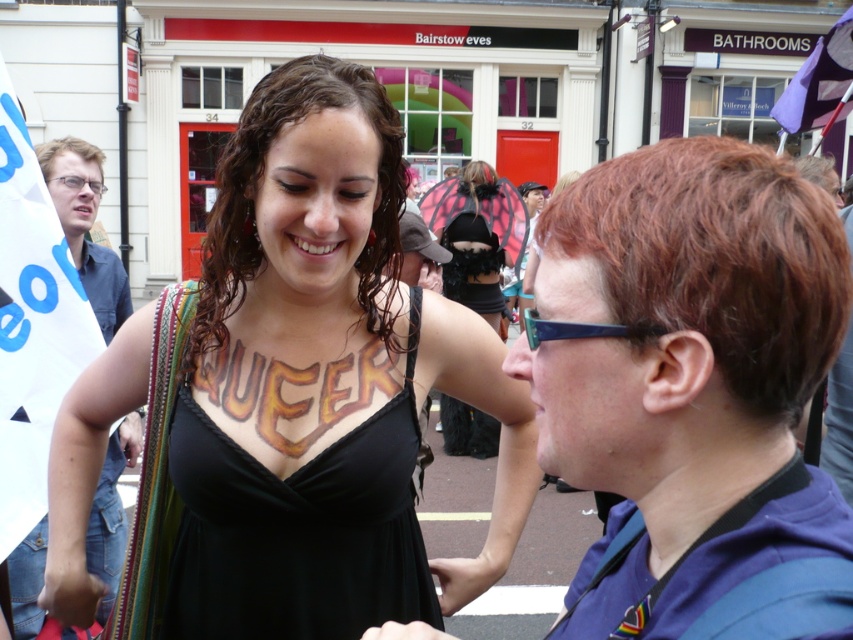
Between black matte dress at center and matte blue hoodie at center, which one appears on the right side from the viewer's perspective?

Positioned to the right is matte blue hoodie at center.

Based on the photo, can you confirm if black matte dress at center is shorter than matte blue hoodie at center?

No, black matte dress at center is not shorter than matte blue hoodie at center.

Who is more forward, (248, 484) or (740, 461)?

Positioned in front is point (740, 461).

Locate an element on the screen. black matte dress at center is located at coordinates (288, 397).

From the picture: Can you confirm if black matte dress at center is positioned to the left of short brown hair at center?

Correct, you'll find black matte dress at center to the left of short brown hair at center.

Is black matte dress at center closer to camera compared to short brown hair at center?

No, it is behind short brown hair at center.

This screenshot has width=853, height=640. In order to click on black matte dress at center in this screenshot , I will do `click(288, 397)`.

Based on the photo, between short brown hair at center and blue plastic glasses at upper center, which one has less height?

With less height is blue plastic glasses at upper center.

Locate an element on the screen. The image size is (853, 640). short brown hair at center is located at coordinates (717, 259).

Locate an element on the screen. short brown hair at center is located at coordinates (717, 259).